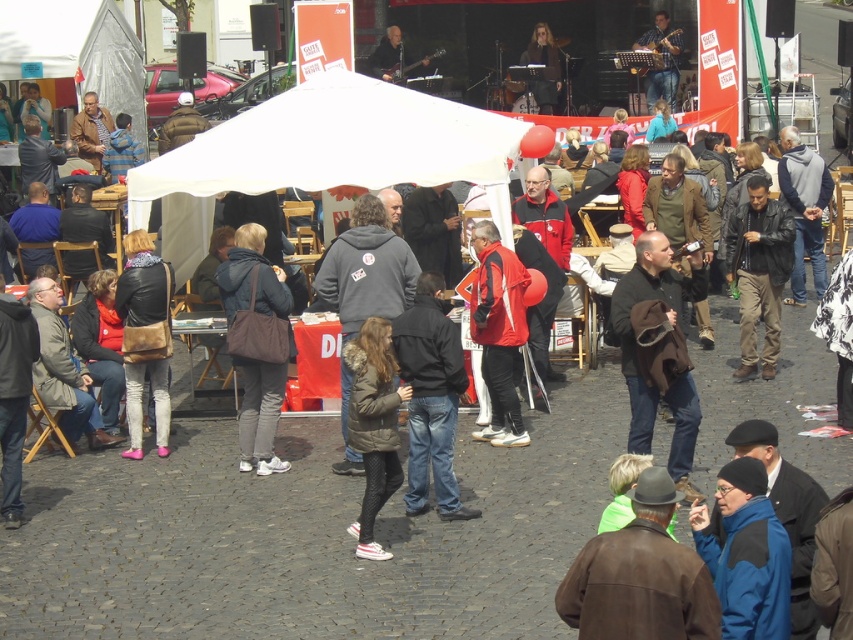
You are a photographer at the event and want to capture both the brown leather jacket at lower right and the dark brown leather jacket at center in a single photo. Which jacket will appear smaller in the photo?

The brown leather jacket at lower right will appear smaller in the photo because it is not as tall as the dark brown leather jacket at center.

You are a photographer standing at the camera position. You want to take a photo of the dark brown leather jacket at center. Is the jacket within your camera lens range? The camera can capture objects up to 10 meters away.

The dark brown leather jacket at center and camera are 12.87 meters apart from each other. Since the camera can only capture objects up to 10 meters away, the jacket is out of range and cannot be photographed clearly.